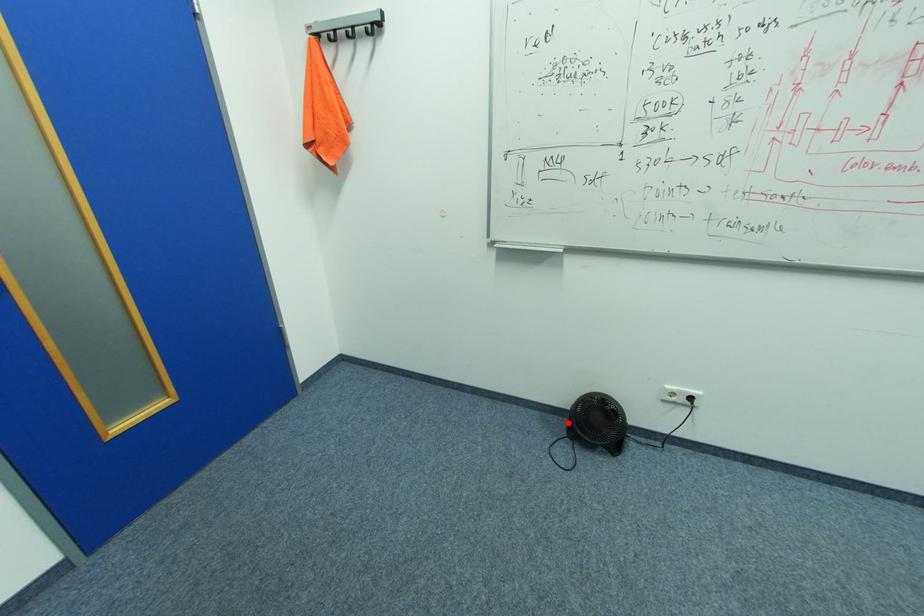
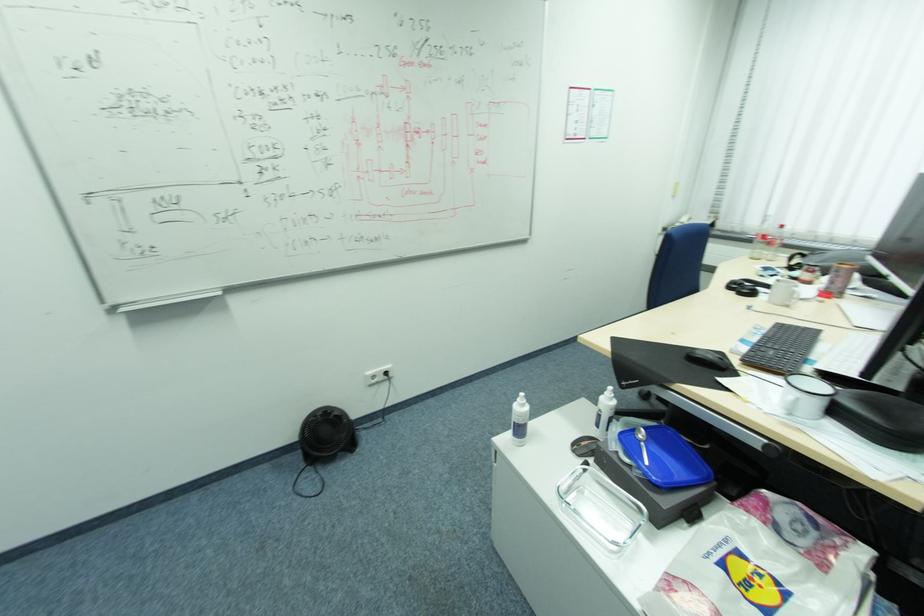
Find the pixel in the second image that matches the highlighted location in the first image.

(304, 456)